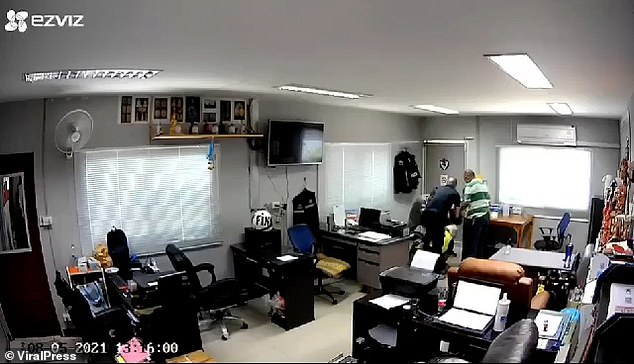
Where is `light`? This screenshot has height=364, width=634. light is located at coordinates tap(527, 75), tap(559, 109), tap(425, 106), tap(333, 92), tap(101, 74).